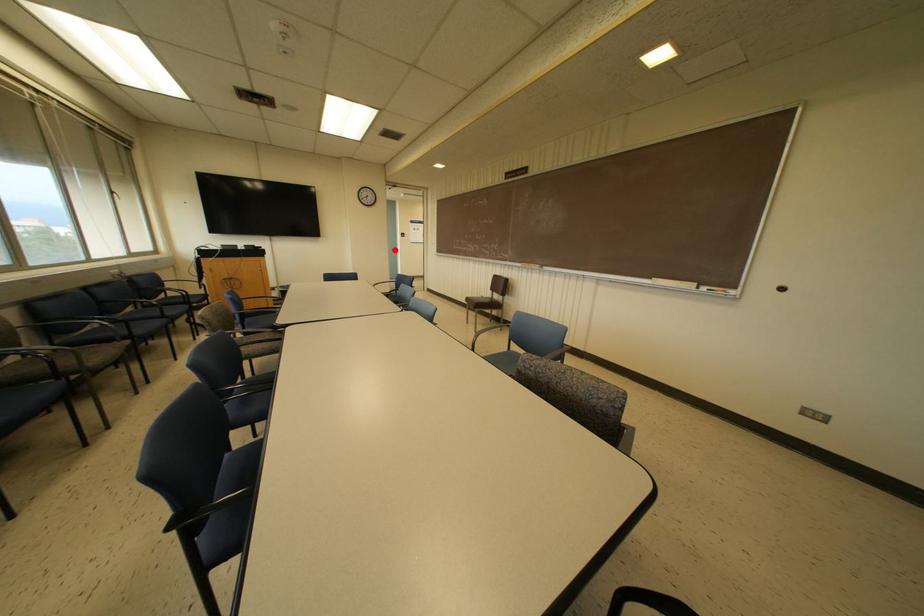
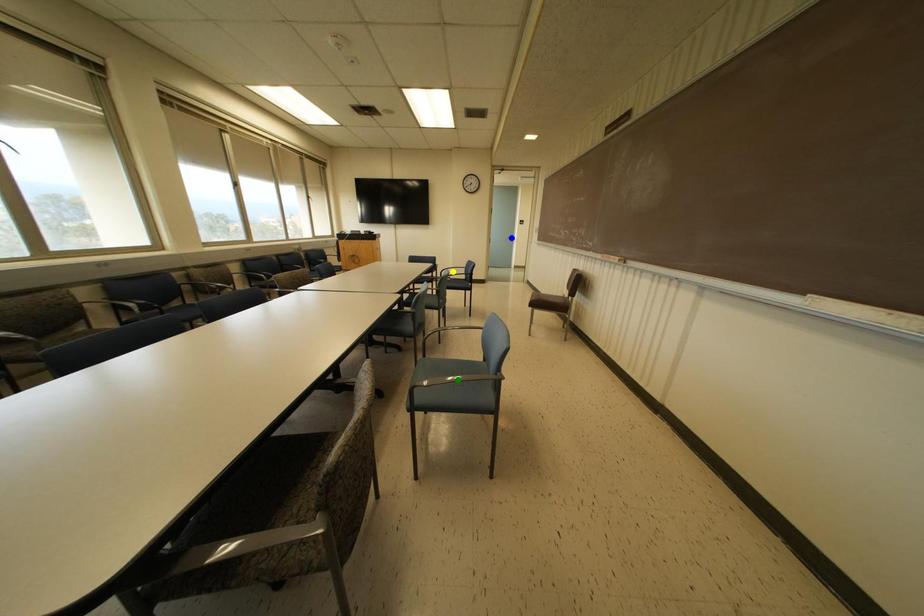
Question: I am providing you with two images of the same scene from different viewpoints. A red point is marked on the first image. You are given multiple points on the second image. In image 2, which mark is for the same physical point as the one in image 1?

Choices:
 (A) blue point
 (B) green point
 (C) yellow point

Answer: (A)